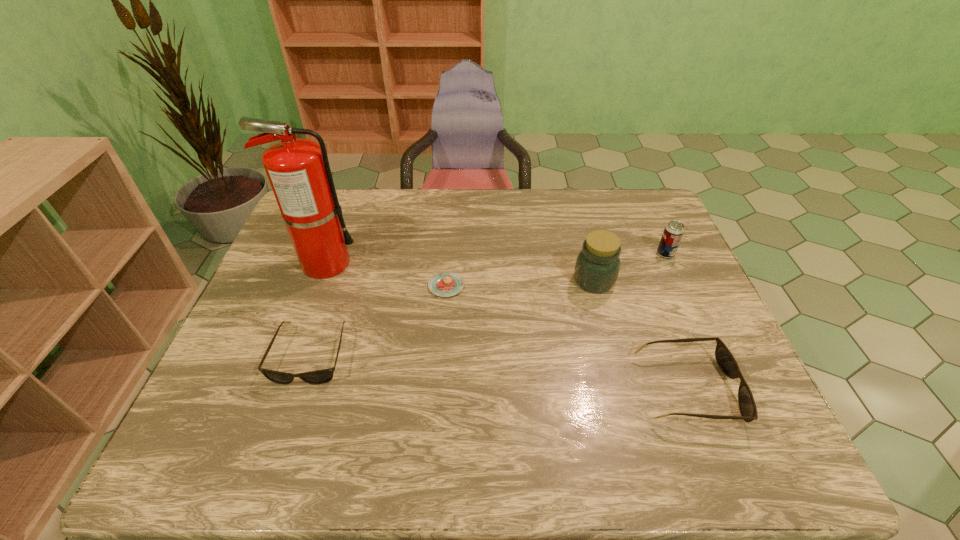
Locate an element on the screen. The height and width of the screenshot is (540, 960). blank area at the near edge is located at coordinates (664, 388).

In the image, there is a desktop. At what (x,y) coordinates should I click in order to perform the action: click on vacant space at the left edge. Please return your answer as a coordinate pair (x, y). The image size is (960, 540). Looking at the image, I should click on (286, 352).

Where is `vacant space at the right edge of the desktop`? The image size is (960, 540). vacant space at the right edge of the desktop is located at coordinates 658,276.

Locate an element on the screen. The image size is (960, 540). vacant space at the far right corner of the desktop is located at coordinates (643, 202).

The image size is (960, 540). In order to click on blank region between the right sunglasses and the fourth shortest object in this screenshot , I will do `click(677, 321)`.

Locate an element on the screen. This screenshot has width=960, height=540. vacant space that is in between the beer can and the right sunglasses is located at coordinates (677, 321).

I want to click on vacant area between the third tallest object and the tallest object, so click(x=495, y=258).

Find the location of `free point between the left sunglasses and the tallest object`. free point between the left sunglasses and the tallest object is located at coordinates (318, 308).

Where is `free spot between the fire extinguisher and the shortest object`? Image resolution: width=960 pixels, height=540 pixels. free spot between the fire extinguisher and the shortest object is located at coordinates (386, 274).

Where is `vacant area that lies between the pastry and the left sunglasses`? Image resolution: width=960 pixels, height=540 pixels. vacant area that lies between the pastry and the left sunglasses is located at coordinates (378, 320).